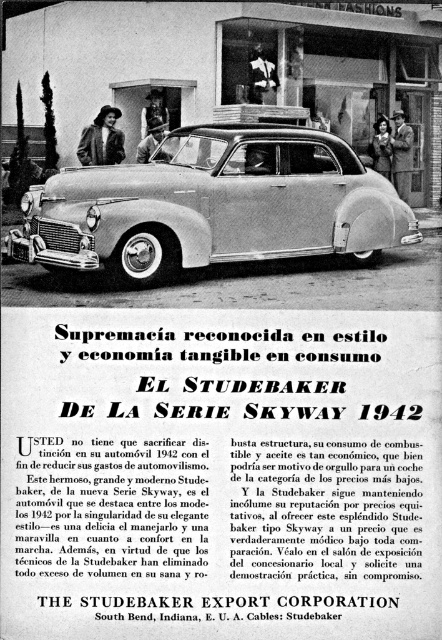
Between silver metallic sedan at center and smooth leather jacket at center, which one has less height?

With less height is silver metallic sedan at center.

Based on the photo, is silver metallic sedan at center above smooth leather jacket at center?

Incorrect, silver metallic sedan at center is not positioned above smooth leather jacket at center.

You are a GUI agent. You are given a task and a screenshot of the screen. Output one action in this format:
    pyautogui.click(x=<x>, y=<y>)
    Task: Click on the silver metallic sedan at center
    The image size is (442, 640).
    Given the screenshot: What is the action you would take?
    pyautogui.click(x=213, y=205)

The width and height of the screenshot is (442, 640). What do you see at coordinates (102, 140) in the screenshot? I see `leather jacket at upper left` at bounding box center [102, 140].

Who is higher up, leather jacket at upper left or smooth leather jacket at center?

smooth leather jacket at center

What do you see at coordinates (102, 140) in the screenshot? I see `leather jacket at upper left` at bounding box center [102, 140].

Locate an element on the screen. This screenshot has width=442, height=640. leather jacket at upper left is located at coordinates (102, 140).

Who is shorter, leather jacket at upper left or matte black suit at center?

With less height is matte black suit at center.

Is leather jacket at upper left above matte black suit at center?

Correct, leather jacket at upper left is located above matte black suit at center.

At what (x,y) coordinates should I click in order to perform the action: click on leather jacket at upper left. Please return your answer as a coordinate pair (x, y). This screenshot has width=442, height=640. Looking at the image, I should click on (102, 140).